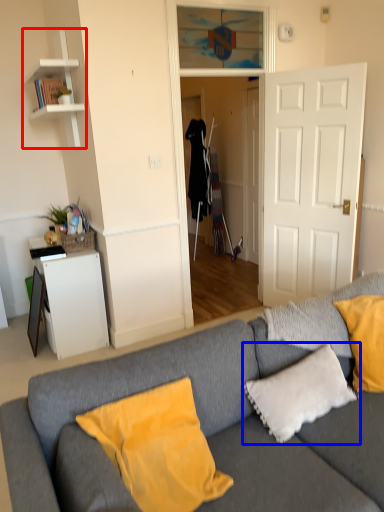
Question: Which object is closer to the camera taking this photo, shelf (highlighted by a red box) or pillow (highlighted by a blue box)?

Choices:
 (A) shelf
 (B) pillow

Answer: (B)